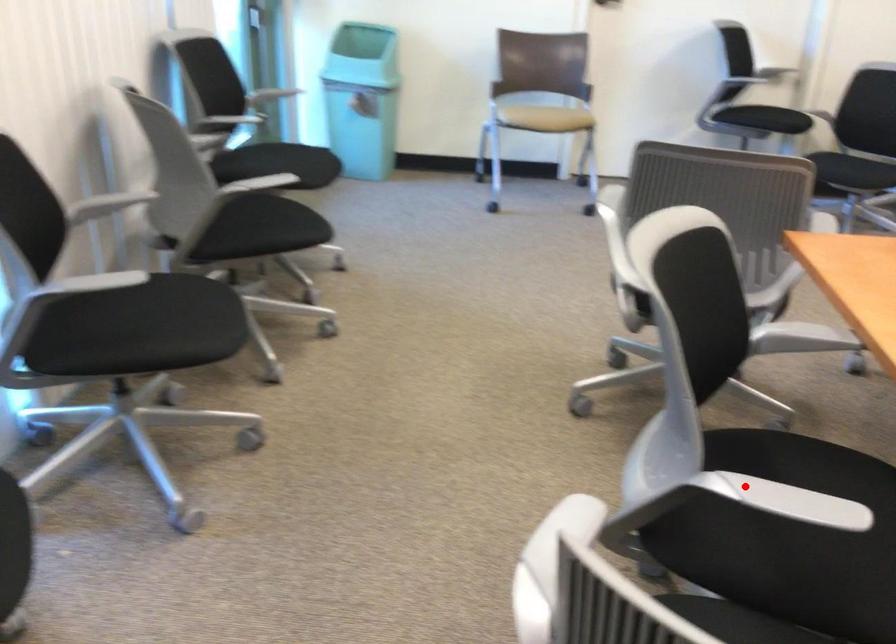
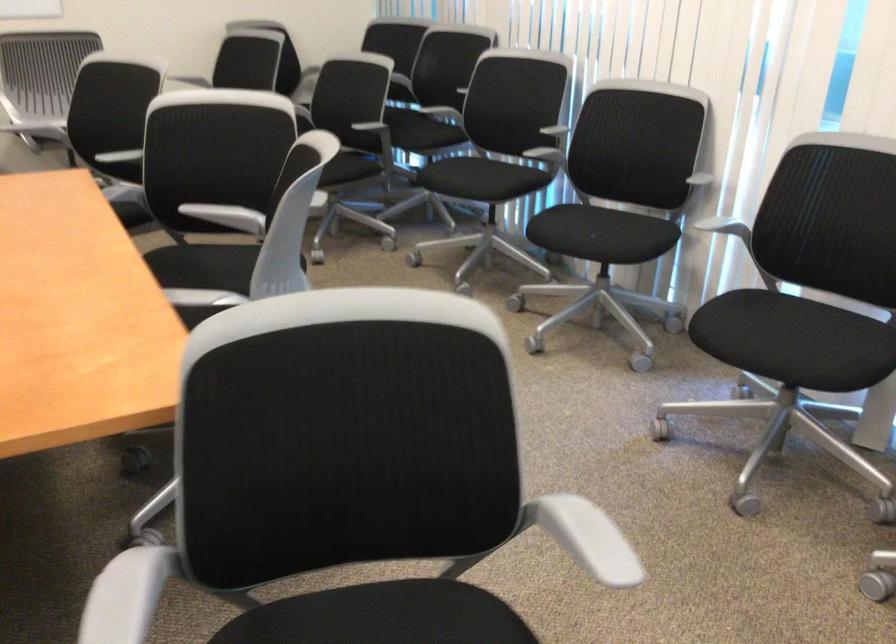
Question: I am providing you with two images of the same scene from different viewpoints. Image1 has a red point marked. In image2, the corresponding 3D location appears at what relative position? Reply with the corresponding letter.

Choices:
 (A) Closer
 (B) Farther

Answer: (B)